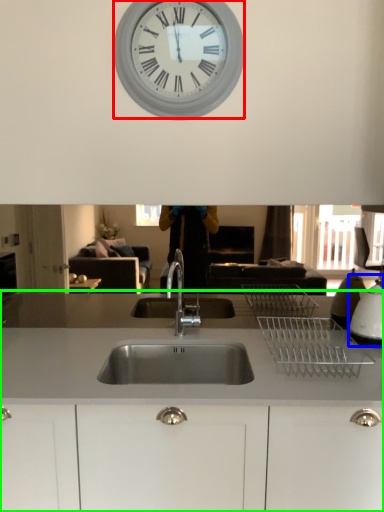
Question: Considering the real-world distances, which object is farthest from wall clock (highlighted by a red box)? appliance (highlighted by a blue box) or countertop (highlighted by a green box)?

Choices:
 (A) appliance
 (B) countertop

Answer: (A)